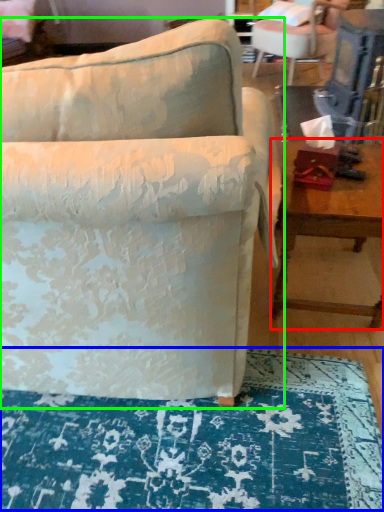
Question: Which object is positioned farthest from table (highlighted by a red box)? Select from mat (highlighted by a blue box) and chair (highlighted by a green box).

Choices:
 (A) mat
 (B) chair

Answer: (A)